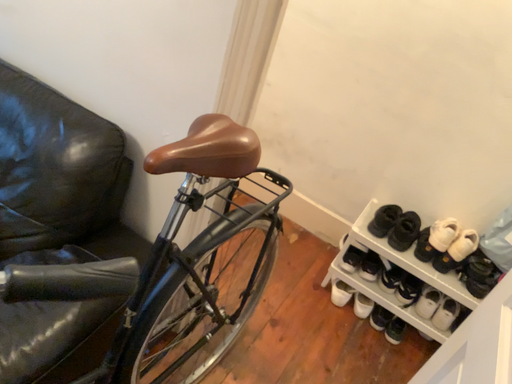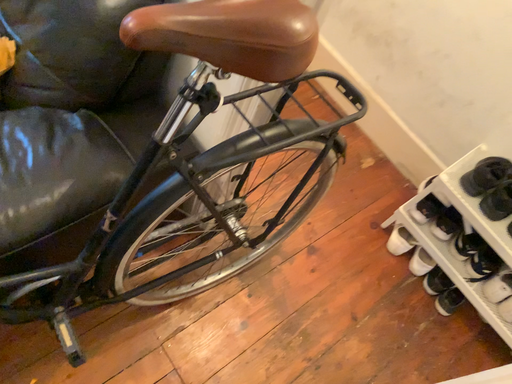
Question: Which way did the camera rotate in the video?

Choices:
 (A) rotated downward
 (B) rotated upward

Answer: (A)